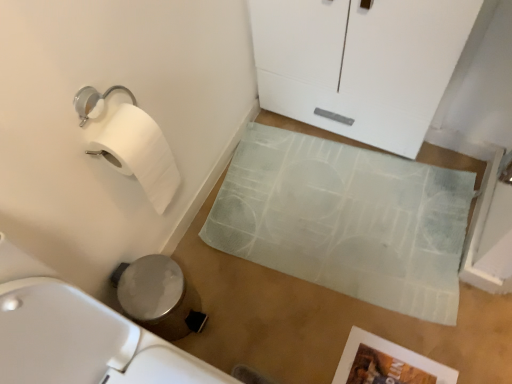
Question: Are white glossy cabinet at upper center and white textured bath mat at center making contact?

Choices:
 (A) no
 (B) yes

Answer: (A)

Question: Is white glossy cabinet at upper center oriented away from white textured bath mat at center?

Choices:
 (A) yes
 (B) no

Answer: (B)

Question: Does white glossy cabinet at upper center have a greater height compared to white textured bath mat at center?

Choices:
 (A) no
 (B) yes

Answer: (B)

Question: From the image's perspective, is white glossy cabinet at upper center over white textured bath mat at center?

Choices:
 (A) yes
 (B) no

Answer: (A)

Question: From the image's perspective, is white glossy cabinet at upper center located beneath white textured bath mat at center?

Choices:
 (A) yes
 (B) no

Answer: (B)

Question: Is white glossy cabinet at upper center positioned behind white textured bath mat at center?

Choices:
 (A) yes
 (B) no

Answer: (B)

Question: Is white textured bath mat at center in contact with white glossy cabinet at upper center?

Choices:
 (A) yes
 (B) no

Answer: (B)

Question: Is white textured bath mat at center located outside white glossy cabinet at upper center?

Choices:
 (A) yes
 (B) no

Answer: (A)

Question: Is white textured bath mat at center turned away from white glossy cabinet at upper center?

Choices:
 (A) yes
 (B) no

Answer: (A)

Question: Is white textured bath mat at center closer to camera compared to white glossy cabinet at upper center?

Choices:
 (A) no
 (B) yes

Answer: (A)

Question: Is white textured bath mat at center aimed at white glossy cabinet at upper center?

Choices:
 (A) yes
 (B) no

Answer: (B)

Question: From the image's perspective, is white textured bath mat at center located beneath white glossy cabinet at upper center?

Choices:
 (A) no
 (B) yes

Answer: (B)

Question: From a real-world perspective, is white glossy cabinet at upper center above or below white textured bath mat at center?

Choices:
 (A) above
 (B) below

Answer: (A)